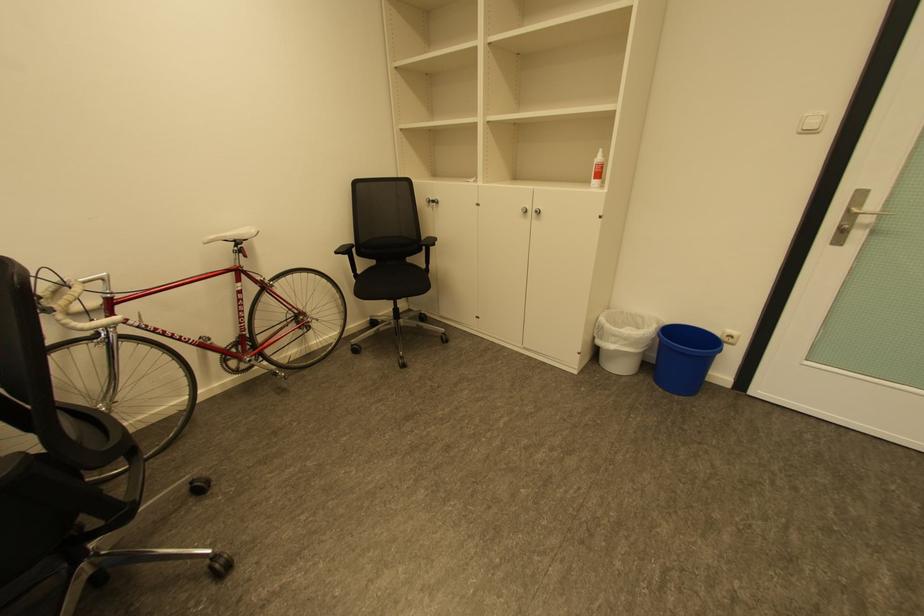
This screenshot has width=924, height=616. Find the location of `silver cabinet key`. silver cabinet key is located at coordinates (841, 233).